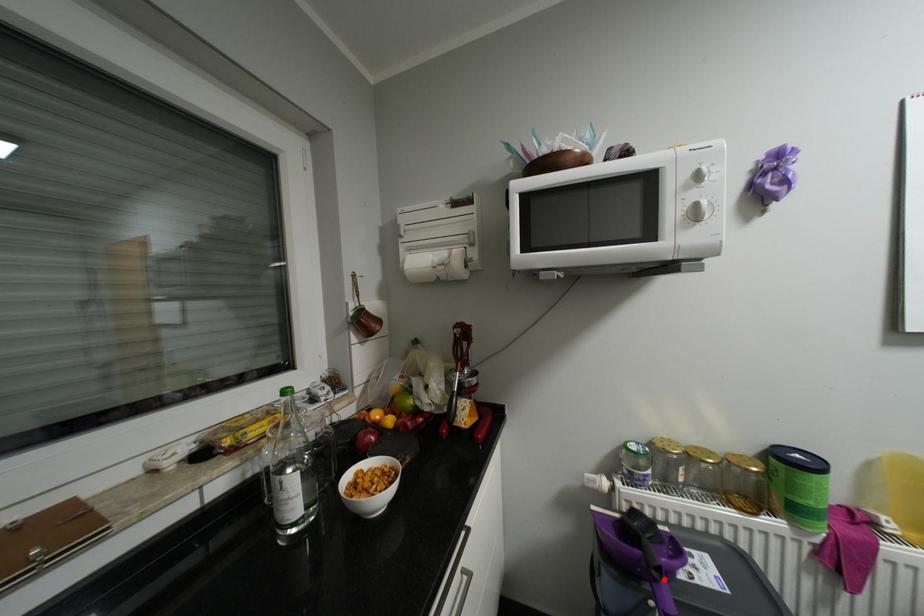
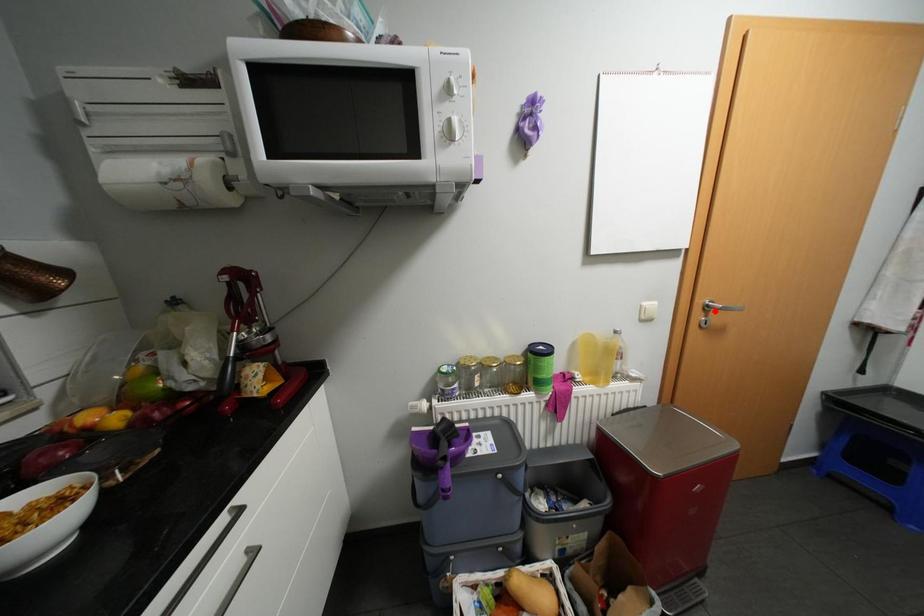
I am providing you with two images of the same scene from different viewpoints. A red point is marked on the first image and another point is marked on the second image. Does the point marked in image1 correspond to the same location as the one in image2?

No